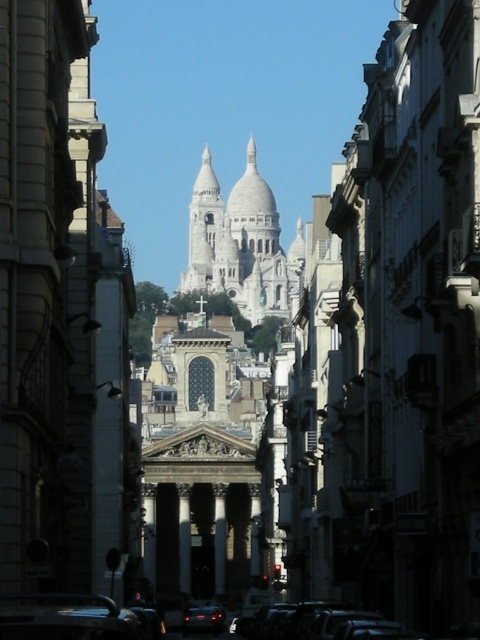
Is point (300, 257) more distant than point (187, 625)?

Yes, point (300, 257) is farther from viewer.

Which is behind, point (300, 236) or point (218, 616)?

Point (300, 236)

Which is behind, point (201, 282) or point (217, 632)?

The point (201, 282) is behind.

This screenshot has width=480, height=640. I want to click on white stone tower at center, so click(240, 243).

The height and width of the screenshot is (640, 480). Identify the location of shiny black car at lower center. (66, 618).

Can you confirm if shiny black car at lower center is positioned to the left of black glossy car at lower center?

Yes, shiny black car at lower center is to the left of black glossy car at lower center.

Does point (71, 596) come farther from viewer compared to point (359, 611)?

No, it is not.

This screenshot has width=480, height=640. Identify the location of shiny black car at lower center. (66, 618).

Is shiny black car at lower center above shiny black car at center?

Yes, shiny black car at lower center is above shiny black car at center.

Is point (55, 630) positioned in front of point (188, 620)?

Yes, it is.

The image size is (480, 640). I want to click on shiny black car at lower center, so click(66, 618).